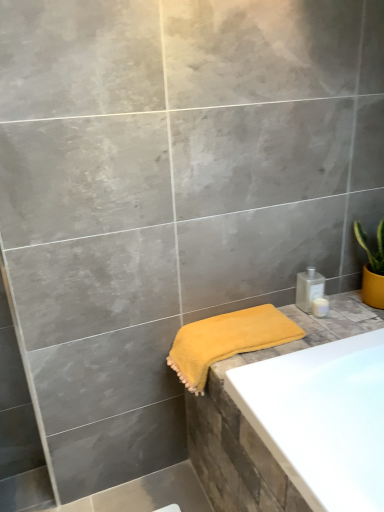
I want to click on vacant space that is to the left of white glossy soap dispenser at upper right, the first toiletry when ordered from bottom to top, so click(292, 323).